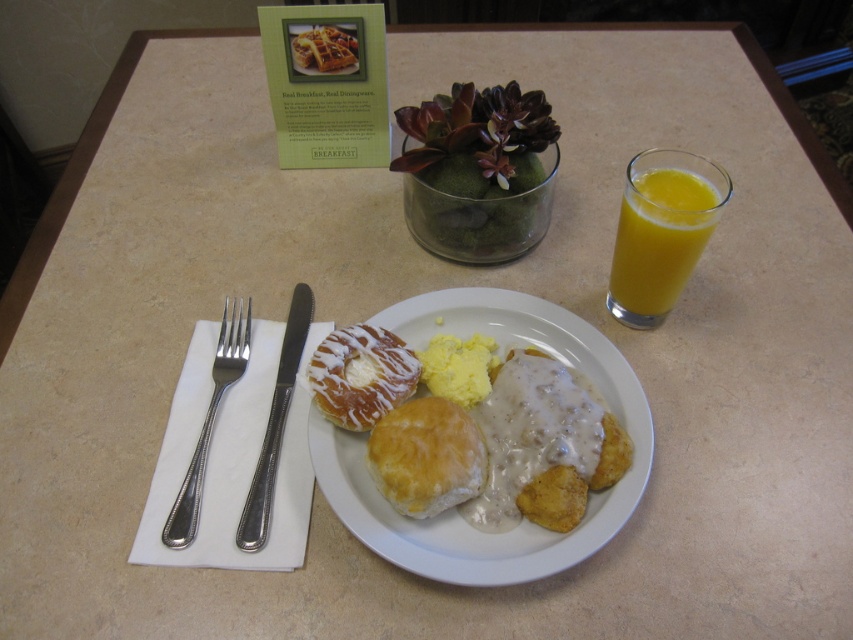
Question: Is golden-brown glazed biscuit at center wider than golden crispy waffle at center?

Choices:
 (A) no
 (B) yes

Answer: (B)

Question: Is translucent glass of orange juice at right thinner than golden crispy waffle at center?

Choices:
 (A) no
 (B) yes

Answer: (A)

Question: Does golden-brown glazed biscuit at center appear over translucent glass of orange juice at right?

Choices:
 (A) no
 (B) yes

Answer: (A)

Question: Which of these objects is positioned farthest from the translucent glass of orange juice at right?

Choices:
 (A) golden glazed biscuit at center
 (B) silver metallic fork at left
 (C) golden crispy waffle at center

Answer: (B)

Question: Among these objects, which one is nearest to the camera?

Choices:
 (A) golden-brown glazed biscuit at center
 (B) silver metallic fork at left

Answer: (A)

Question: Which object is closer to the camera taking this photo?

Choices:
 (A) silver metallic fork at left
 (B) glazed doughnut at center

Answer: (A)